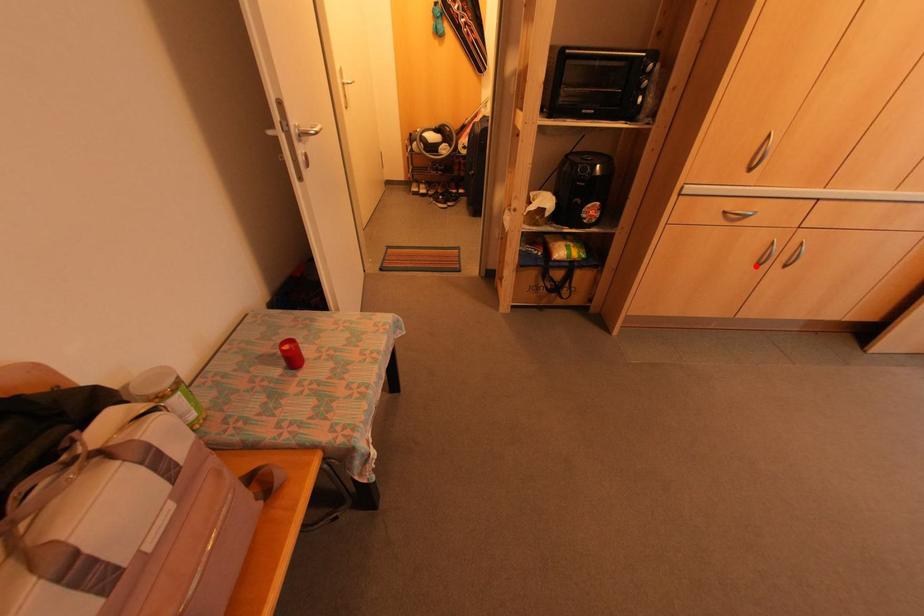
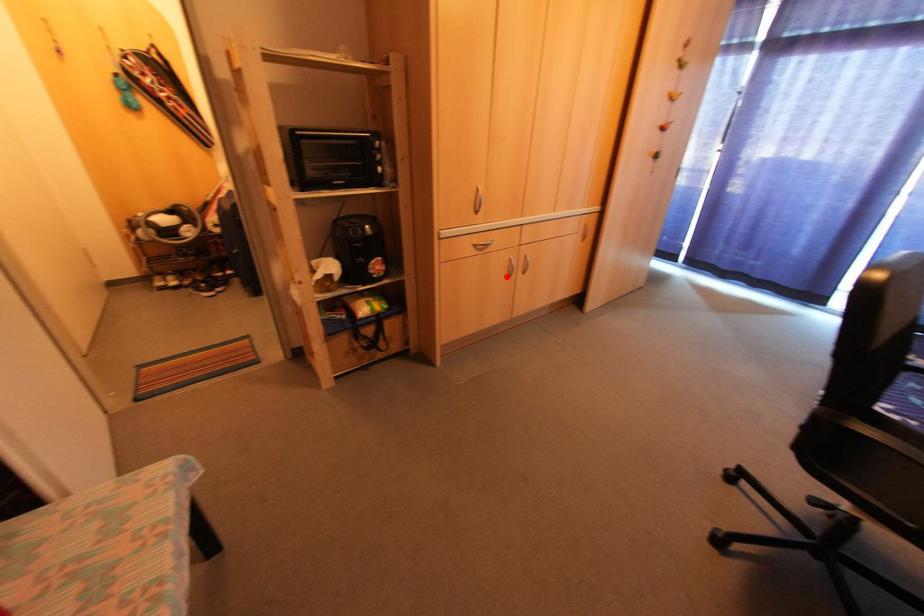
I am providing you with two images of the same scene from different viewpoints. A red point is marked on the first image and another point is marked on the second image. Do the highlighted points in image1 and image2 indicate the same real-world spot?

Yes